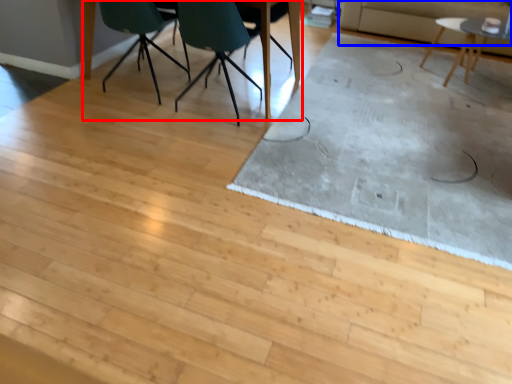
Question: Which object appears closest to the camera in this image, table (highlighted by a red box) or couch (highlighted by a blue box)?

Choices:
 (A) table
 (B) couch

Answer: (A)